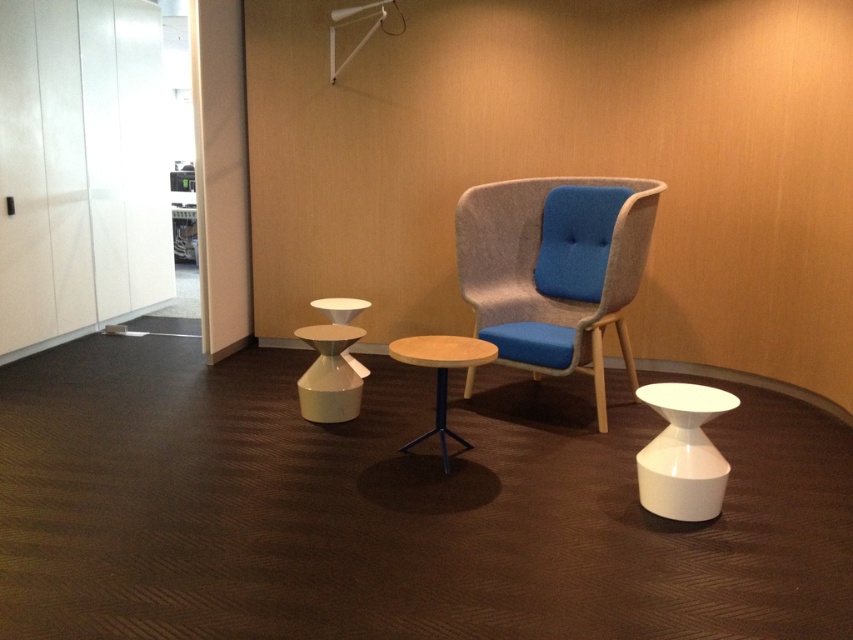
Is textured wool swivel chair at center shorter than white glossy side table at center?

In fact, textured wool swivel chair at center may be taller than white glossy side table at center.

Measure the distance from textured wool swivel chair at center to white glossy side table at center.

They are 3.31 feet apart.

Identify the location of textured wool swivel chair at center. The width and height of the screenshot is (853, 640). (554, 268).

Is white glossy side table at center wider than wooden/matte side table at center?

No.

Based on the photo, who is positioned more to the right, white glossy side table at center or wooden/matte side table at center?

wooden/matte side table at center

Is point (340, 348) positioned before point (437, 342)?

No, (340, 348) is behind (437, 342).

Locate an element on the screen. white glossy side table at center is located at coordinates (329, 374).

What do you see at coordinates (683, 452) in the screenshot? I see `white glossy side table at lower right` at bounding box center [683, 452].

Is white glossy side table at lower right bigger than white glossy side table at center?

No.

Image resolution: width=853 pixels, height=640 pixels. What do you see at coordinates (683, 452) in the screenshot?
I see `white glossy side table at lower right` at bounding box center [683, 452].

I want to click on white glossy side table at lower right, so click(683, 452).